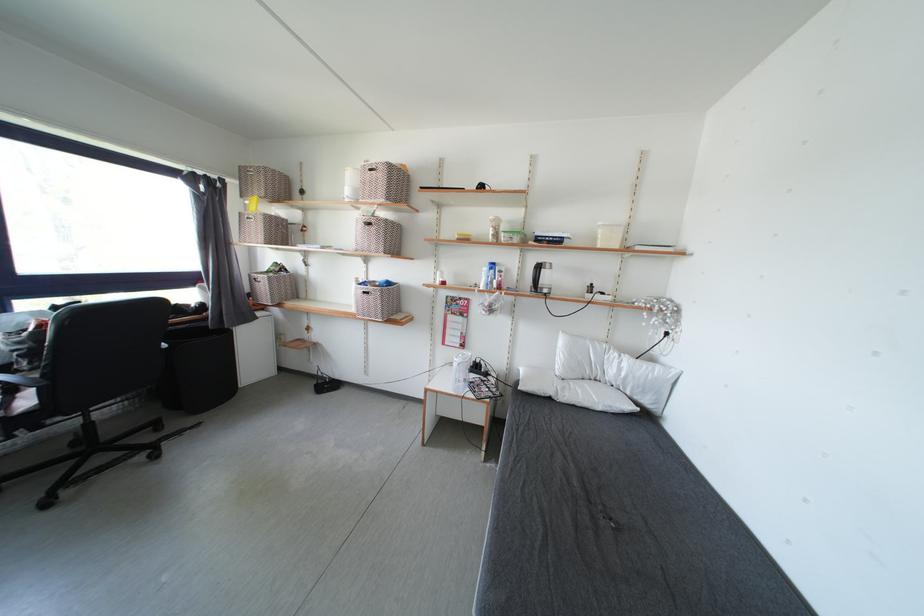
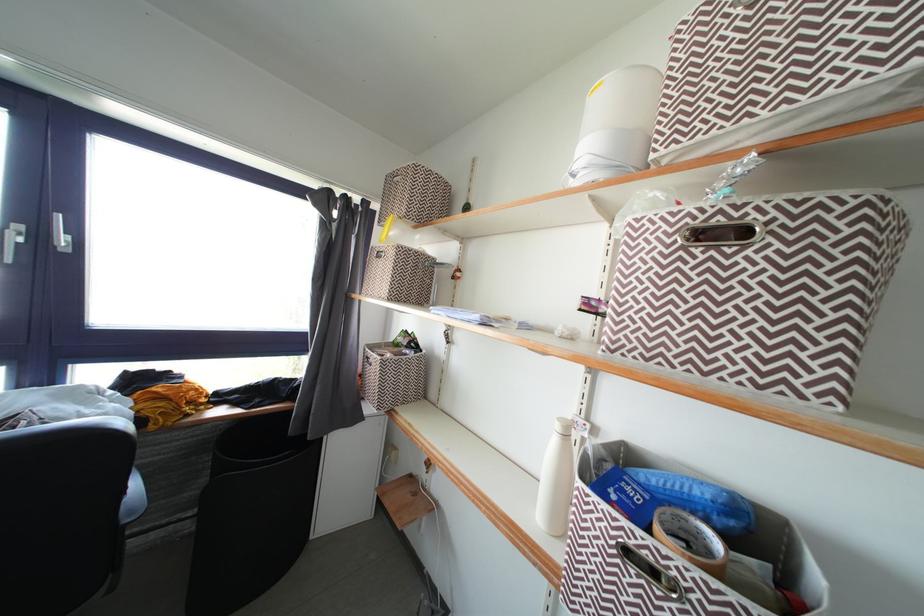
The point at (371, 293) is marked in the first image. Where is the corresponding point in the second image?

(643, 541)